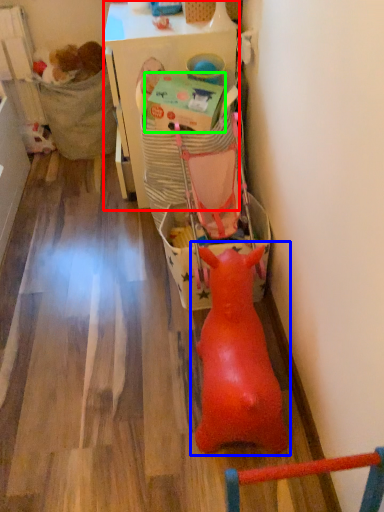
Question: Which object is the farthest from table (highlighted by a red box)? Choose among these: toy (highlighted by a blue box) or box (highlighted by a green box).

Choices:
 (A) toy
 (B) box

Answer: (A)